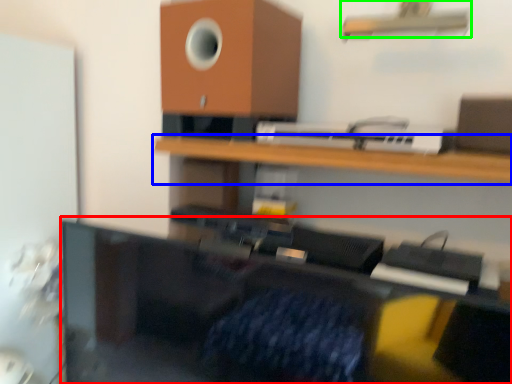
Question: Based on their relative distances, which object is nearer to furniture (highlighted by a red box)? Choose from shelf (highlighted by a blue box) and shelf (highlighted by a green box).

Choices:
 (A) shelf
 (B) shelf

Answer: (A)